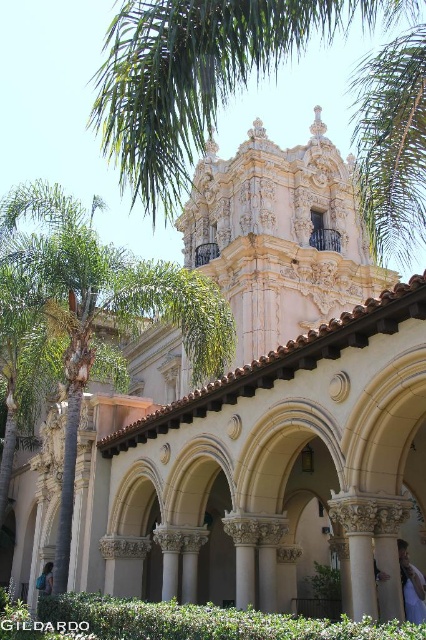
Does green leafy palm tree at upper center have a larger size compared to blue backpack at center?

Yes.

Measure the distance between point (x=98, y=100) and camera.

Point (x=98, y=100) is 145.24 feet away from camera.

You are a GUI agent. You are given a task and a screenshot of the screen. Output one action in this format:
    pyautogui.click(x=<x>, y=<y>)
    Task: Click on the green leafy palm tree at upper center
    Image resolution: width=426 pixels, height=640 pixels.
    Given the screenshot: What is the action you would take?
    pyautogui.click(x=245, y=84)

The image size is (426, 640). What do you see at coordinates (94, 308) in the screenshot?
I see `green leafy palm tree at center` at bounding box center [94, 308].

Who is more forward, [86,353] or [49,570]?

Point [86,353] is in front.

Find the location of a particular element. green leafy palm tree at center is located at coordinates (94, 308).

Between blue fabric at lower right and blue backpack at center, which one appears on the left side from the viewer's perspective?

Positioned to the left is blue backpack at center.

How distant is blue fabric at lower right from blue backpack at center?

blue fabric at lower right is 46.25 meters away from blue backpack at center.

Is point (408, 582) closer to camera compared to point (45, 570)?

Yes, point (408, 582) is closer to viewer.

What are the coordinates of `blue fabric at lower right` in the screenshot? It's located at (411, 586).